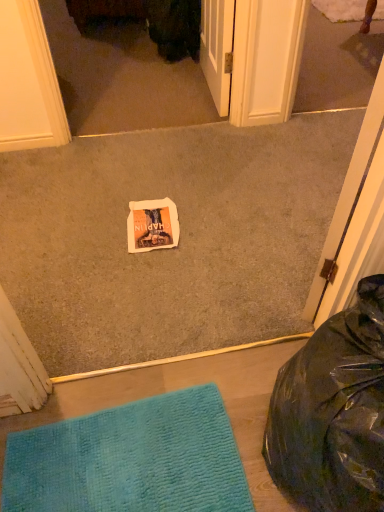
Identify the location of free space above white paper at center (from a real-world perspective). (145, 221).